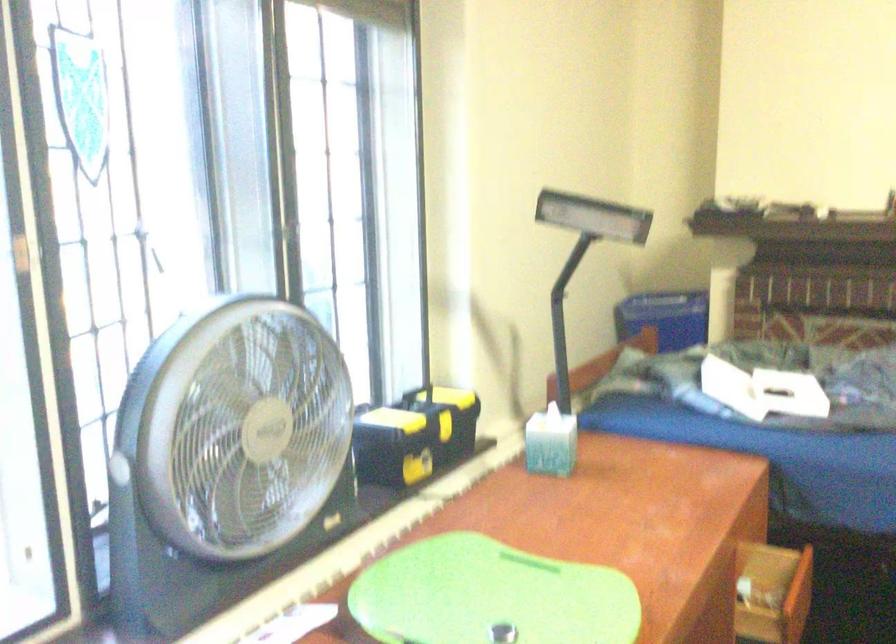
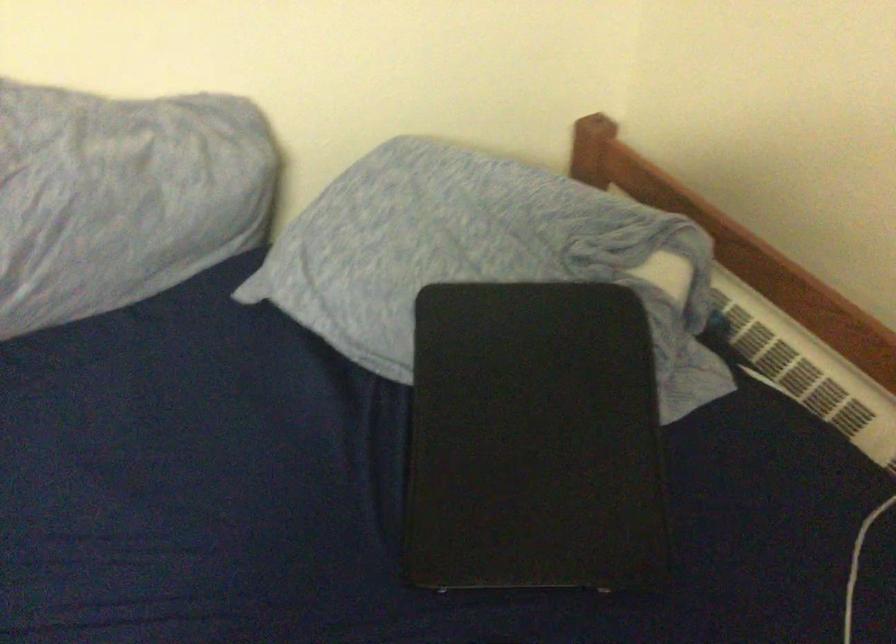
From the picture: How did the camera likely rotate?

The rotation direction of the camera is left-down.